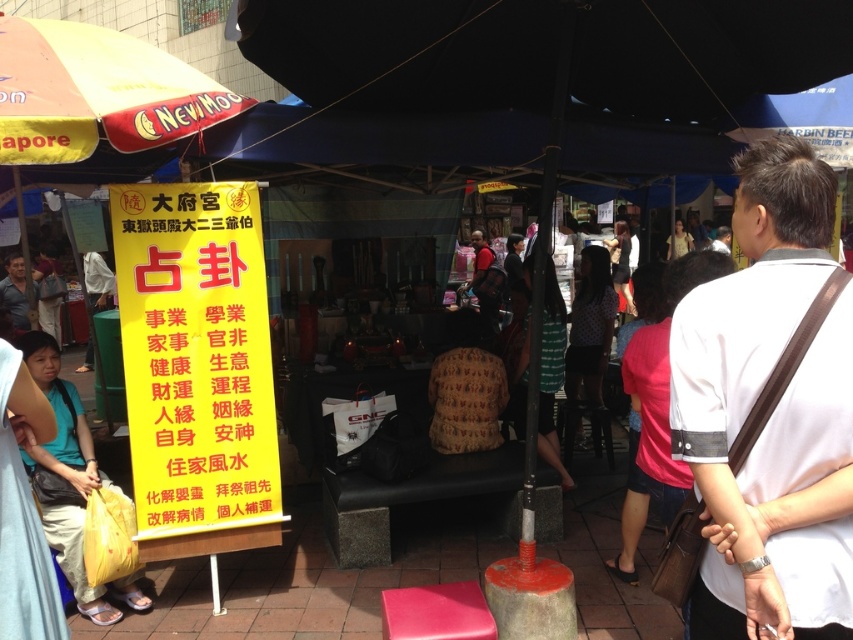
Which of these two, white fabric shirt at center or yellow plastic bag at lower left, stands shorter?

With less height is white fabric shirt at center.

This screenshot has height=640, width=853. Identify the location of white fabric shirt at center. (770, 413).

Which of these two, white fabric shirt at center or yellow paper sign at center, stands taller?

yellow paper sign at center

Which is above, white fabric shirt at center or yellow paper sign at center?

white fabric shirt at center is higher up.

Who is more distant from viewer, (x=780, y=570) or (x=234, y=284)?

Positioned behind is point (x=234, y=284).

Identify the location of white fabric shirt at center. (770, 413).

Between point (260, 342) and point (51, 468), which one is positioned behind?

Point (260, 342)

Is yellow paper sign at center taller than yellow plastic bag at lower left?

Indeed, yellow paper sign at center has a greater height compared to yellow plastic bag at lower left.

Identify the location of yellow paper sign at center. Image resolution: width=853 pixels, height=640 pixels. (195, 356).